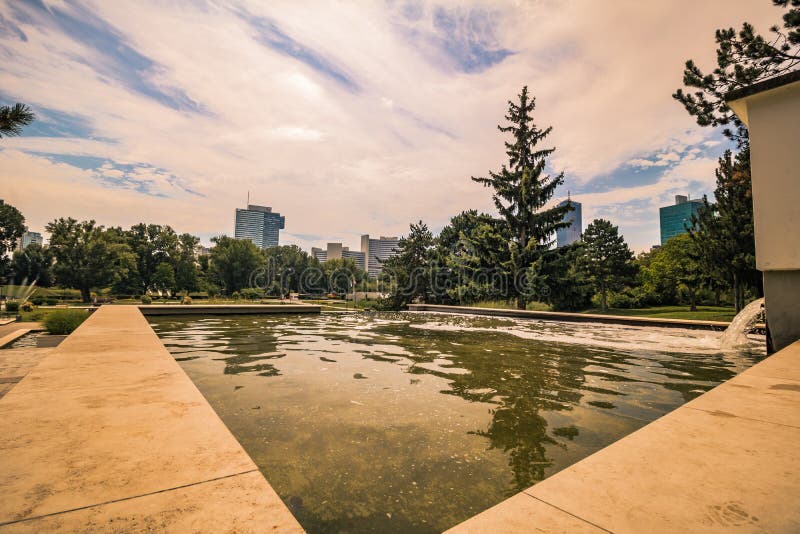
Find the location of a particular element. Image resolution: width=800 pixels, height=534 pixels. foam is located at coordinates (628, 343).